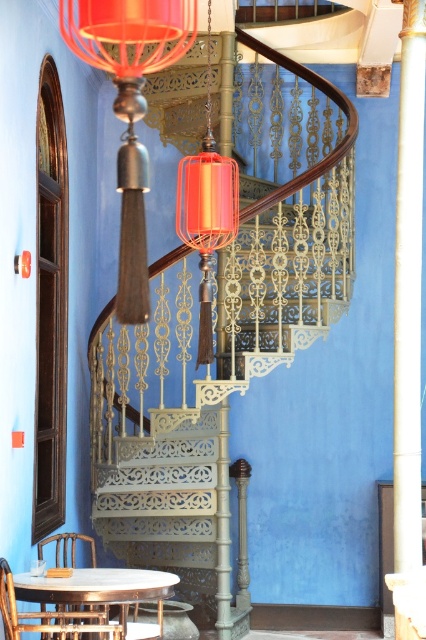
You are an interior designer planning to install a new 7 feet wide sofa in this space. The sofa will be placed between the metallic staircase at center and the matte silver lamp at center. Based on the available space, will the sofa fit comfortably between them?

The distance between the metallic staircase at center and the matte silver lamp at center is 6.61 feet. Since the sofa is 7 feet wide, it will not fit comfortably between them as the space is slightly narrower than the sofa.